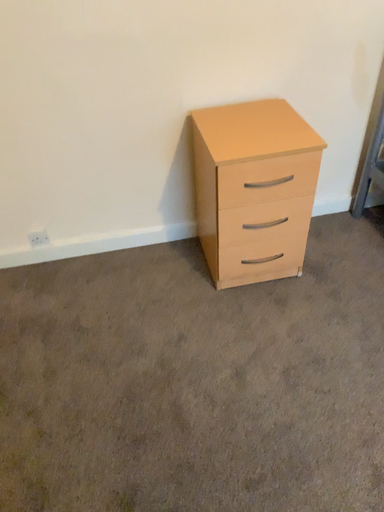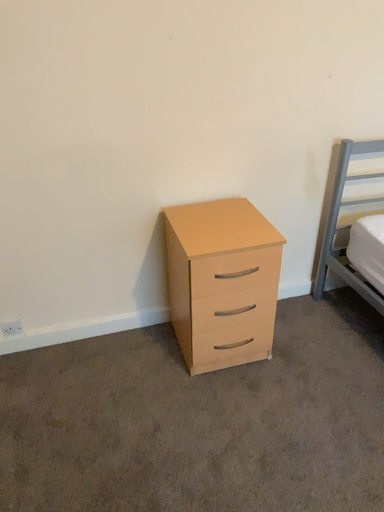
Question: Which way did the camera rotate in the video?

Choices:
 (A) rotated downward
 (B) rotated upward

Answer: (B)